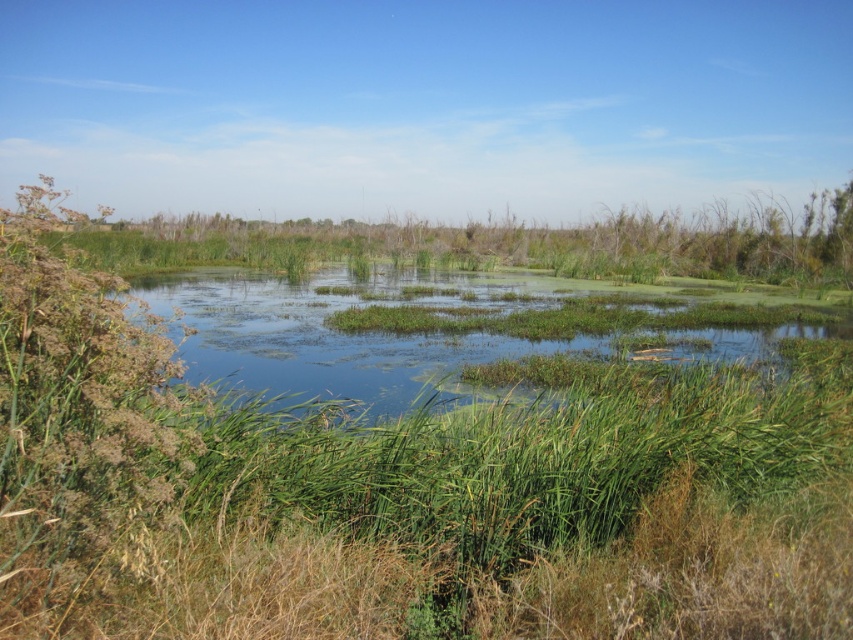
Does green grassy wetland at center have a larger size compared to green grassy lake at center?

No.

Does point (44, 520) lie in front of point (462, 310)?

Yes.

The width and height of the screenshot is (853, 640). Describe the element at coordinates (403, 490) in the screenshot. I see `green grassy wetland at center` at that location.

Locate an element on the screen. green grassy wetland at center is located at coordinates tap(403, 490).